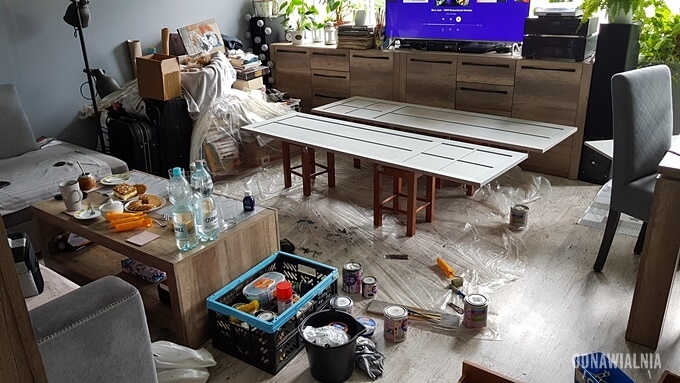
At what (x,y) coordinates should I click in order to perform the action: click on places to sit. Please return your answer as a coordinate pair (x, y). Image resolution: width=680 pixels, height=383 pixels. Looking at the image, I should click on (649, 186), (41, 165), (39, 293).